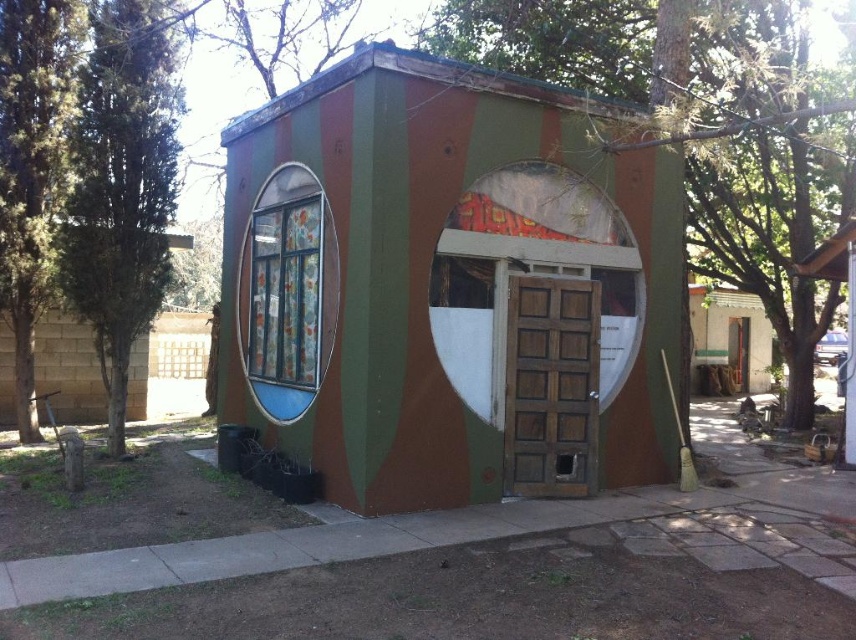
From the picture: You are planning to paint a camouflage pattern on a door similar to the white painted wood door at center. However, you only have enough paint to cover an area that is the same size as the camouflage paint hut at center. Will the paint be sufficient?

The camouflage paint hut at center is bigger than the white painted wood door at center. Since the paint can only cover the area of the camouflage paint hut at center, it will be sufficient for the door as it is smaller.

You are a delivery person trying to deliver a package to the camouflage paint hut at center. The delivery truck is 2 meters wide. Can the truck pass through the white painted wood door at center to reach the hut?

The camouflage paint hut at center might be wider than the white painted wood door at center, so the truck might not be able to pass through the door if the door is narrower than the truck.